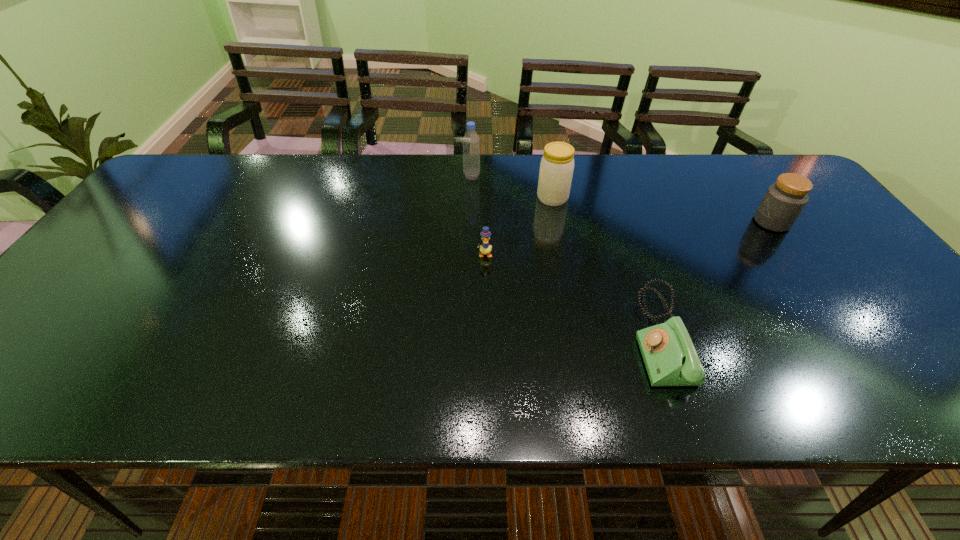
The height and width of the screenshot is (540, 960). Identify the location of vacant space located on the surface of the rightmost object near the warning symbol. (718, 222).

Find the location of a particular element. blank space located 0.310m on the surface of the rightmost object near the warning symbol is located at coordinates (642, 222).

Where is `free region located 0.250m on the surface of the rightmost object near the warning symbol`? The height and width of the screenshot is (540, 960). free region located 0.250m on the surface of the rightmost object near the warning symbol is located at coordinates (664, 222).

I want to click on free region located 0.240m on the face of the duckling, where the monocle is placed, so click(x=486, y=336).

Locate an element on the screen. This screenshot has width=960, height=540. blank area located 0.280m on the dial of the fourth object from left to right is located at coordinates (504, 336).

Locate an element on the screen. vacant space located 0.360m on the dial of the fourth object from left to right is located at coordinates (467, 336).

Locate an element on the screen. The width and height of the screenshot is (960, 540). free space located on the dial of the fourth object from left to right is located at coordinates (513, 336).

You are a GUI agent. You are given a task and a screenshot of the screen. Output one action in this format:
    pyautogui.click(x=<x>, y=<y>)
    Task: Click on the bottle situated at the far edge
    
    Given the screenshot: What is the action you would take?
    pyautogui.click(x=471, y=143)

At what (x,y) coordinates should I click in order to perform the action: click on jar that is at the far edge. Please return your answer as a coordinate pair (x, y). The height and width of the screenshot is (540, 960). Looking at the image, I should click on (557, 164).

Where is `object that is at the near edge`? This screenshot has width=960, height=540. object that is at the near edge is located at coordinates (670, 358).